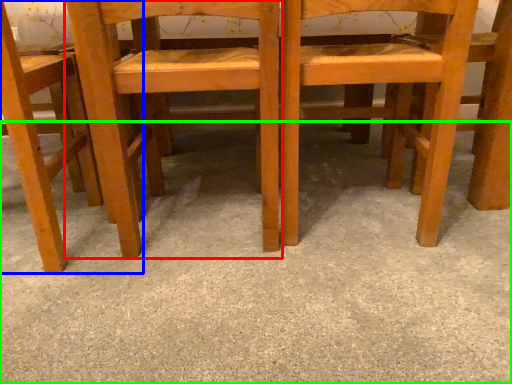
Question: Which object is positioned closest to chair (highlighted by a red box)? Select from chair (highlighted by a blue box) and concrete (highlighted by a green box).

Choices:
 (A) chair
 (B) concrete

Answer: (A)